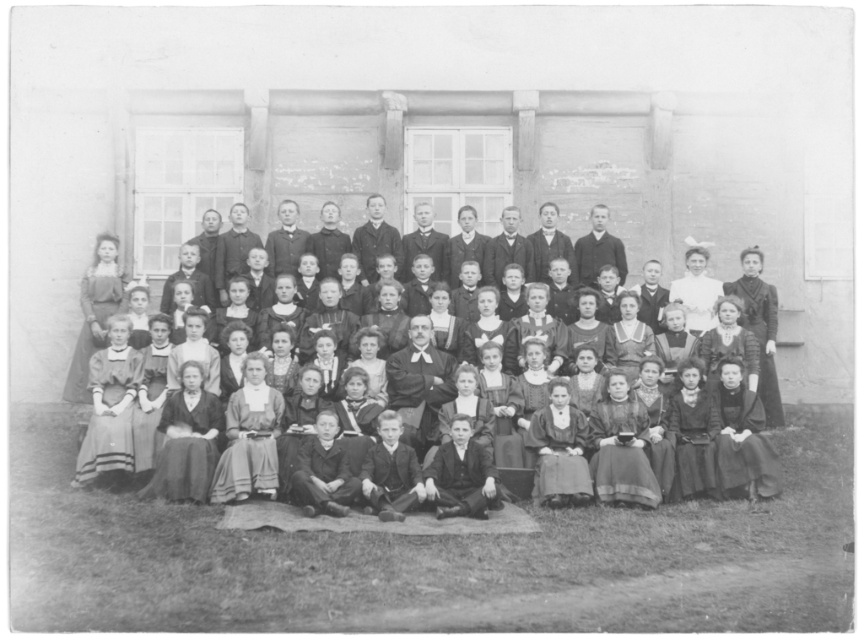
You are a photographer who wants to capture a closeup of both the matte black dress at upper right and the white satin blouse at upper center in the same frame. Given that your camera has a fixed focal length lens with a maximum focus range of 2 meters, will you be able to include both in the shot?

The matte black dress at upper right and white satin blouse at upper center are 2.85 meters apart from each other. Since the maximum focus range of your camera is 2 meters, which is less than the 2.85 meters between the two objects, you will not be able to include both in the same frame with the current settings.

You are standing in front of the historical building in the photograph. You notice two points marked on the building facade. The first point is at coordinates point (102, 262) and the second is at point (669, 289). Which of these two points is closer to you?

Point (102, 262) is closer to you because it is further to the viewer than point (669, 289).

You are standing at point (734,285) and want to reach a point that is 64.72 meters away. Is there any object in the scene that could help you determine the direction to move?

The point (734,285) is 64.72 meters away from the desired location. Since there are no other objects mentioned in the scene besides the building and the group, you would need to rely on the building or the group members for directional guidance.